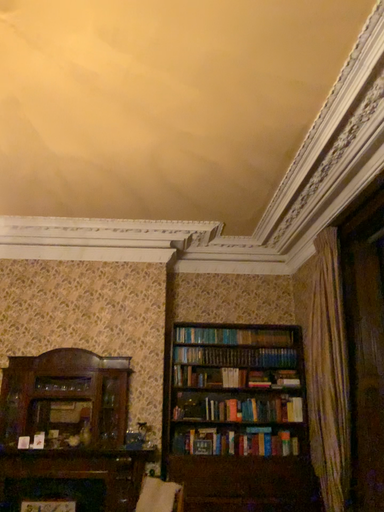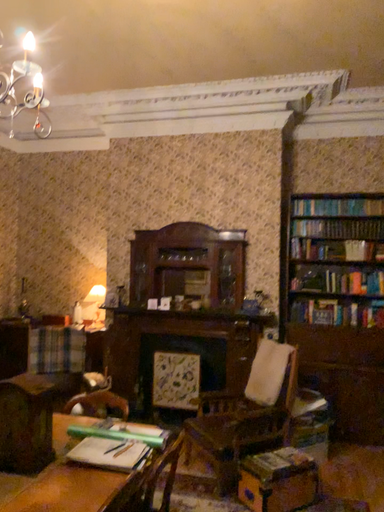
Question: How did the camera likely rotate when shooting the video?

Choices:
 (A) rotated downward
 (B) rotated upward

Answer: (A)